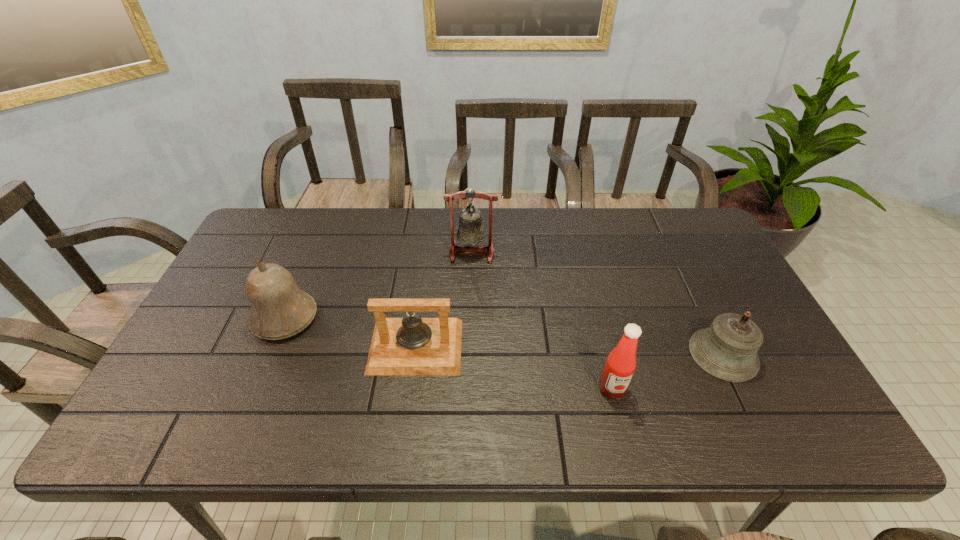
Locate an element on the screen. bell that is the second closest to the farthest bell is located at coordinates (279, 308).

At what (x,y) coordinates should I click in order to perform the action: click on blank area in the image that satisfies the following two spatial constraints: 1. on the front side of the leftmost object; 2. on the right side of the rightmost bell. Please return your answer as a coordinate pair (x, y). Looking at the image, I should click on (270, 354).